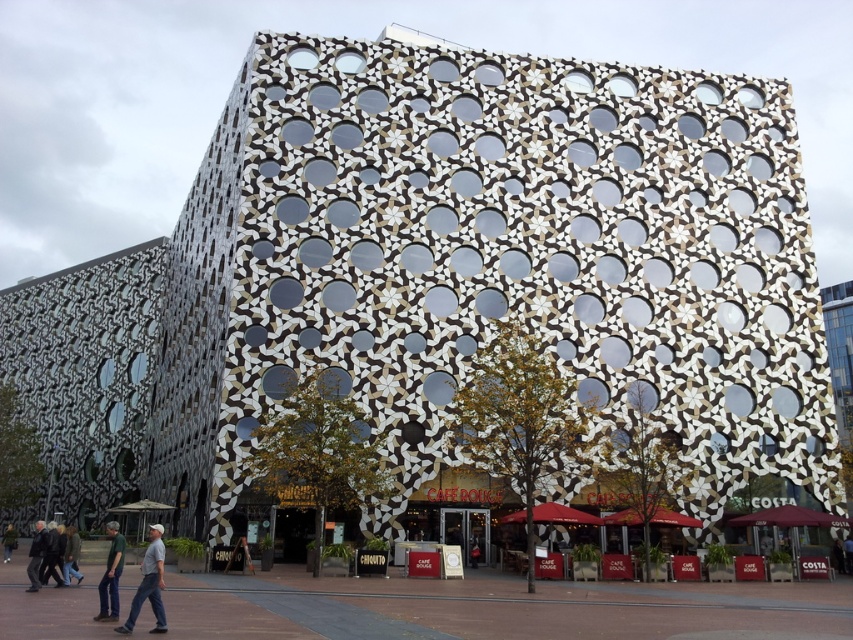
Is point (146, 588) in front of point (109, 609)?

That is True.

Looking at this image, which is more to the left, gray fabric pants at lower left or dark green shirt at lower left?

dark green shirt at lower left

Measure the distance between point (154,595) and camera.

75.06 feet

What are the coordinates of `gray fabric pants at lower left` in the screenshot? It's located at (149, 584).

Is point (122, 544) farther from camera compared to point (33, 560)?

No, (122, 544) is closer to viewer.

Can you confirm if dark green shirt at lower left is positioned to the right of dark gray jacket at lower left?

Yes, dark green shirt at lower left is to the right of dark gray jacket at lower left.

Between point (111, 525) and point (33, 545), which one is positioned behind?

Point (33, 545)

At what (x,y) coordinates should I click in order to perform the action: click on dark green shirt at lower left. Please return your answer as a coordinate pair (x, y). Looking at the image, I should click on (111, 576).

Who is higher up, gray fabric pants at lower left or dark gray jacket at lower left?

gray fabric pants at lower left

Which of these two, gray fabric pants at lower left or dark gray jacket at lower left, stands shorter?

Standing shorter between the two is gray fabric pants at lower left.

Image resolution: width=853 pixels, height=640 pixels. What do you see at coordinates (149, 584) in the screenshot?
I see `gray fabric pants at lower left` at bounding box center [149, 584].

The width and height of the screenshot is (853, 640). I want to click on gray fabric pants at lower left, so click(x=149, y=584).